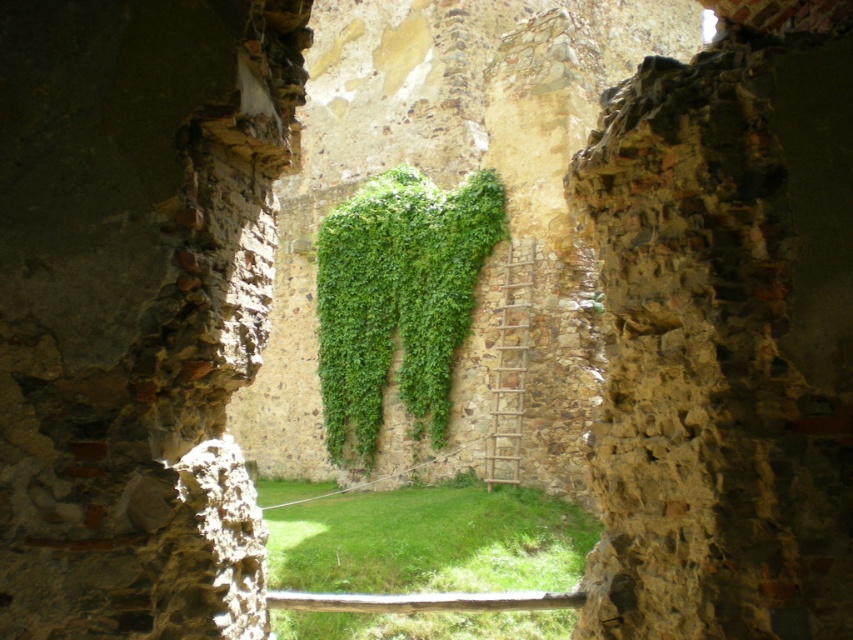
You are standing inside an old stone structure and notice two green elements at the center area. Which one is positioned to the left between the green grass at center and the green leafy ivy at center?

The green grass at center is positioned to the left of the green leafy ivy at center.

You are standing at the entrance of the old stone structure and want to walk towards the green leafy ivy at center. There is green grass at center in your path. How far will you have to walk to reach the ivy after stepping onto the grass?

The green grass at center is 10.81 meters away from the green leafy ivy at center. Therefore, once you step onto the grass, you will need to walk 10.81 meters to reach the ivy.